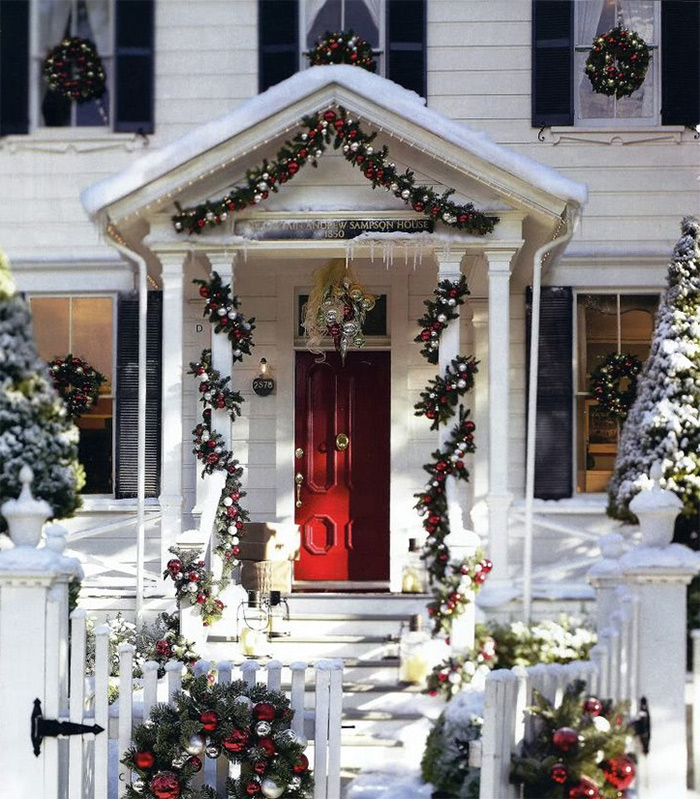
Image resolution: width=700 pixels, height=799 pixels. Find the location of `shutters`. shutters is located at coordinates (561, 472), (139, 427).